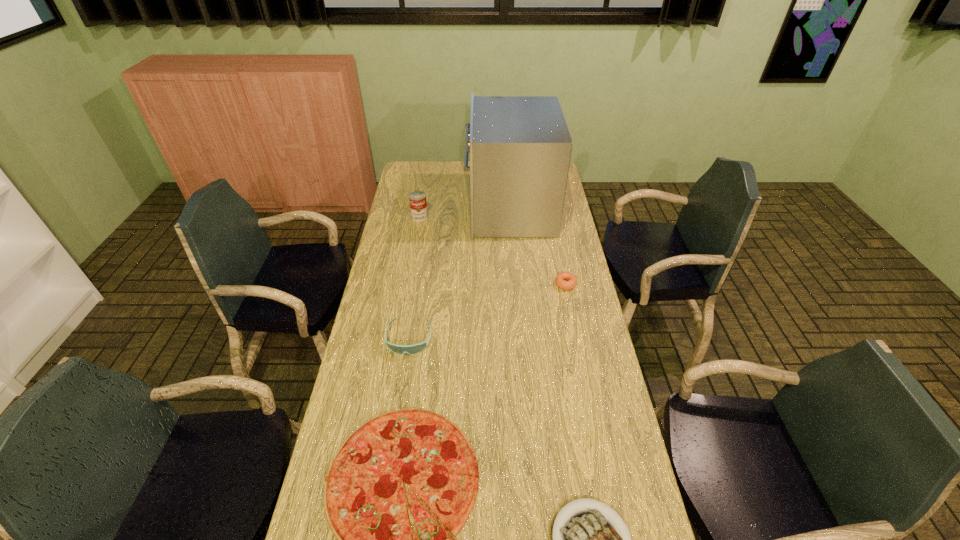
Find the location of `free space between the doughnut and the tallest object`. free space between the doughnut and the tallest object is located at coordinates (538, 247).

Locate an element on the screen. The width and height of the screenshot is (960, 540). blank region between the can and the third farthest object is located at coordinates (492, 250).

This screenshot has width=960, height=540. I want to click on vacant area between the fourth farthest object and the toaster oven, so click(459, 274).

This screenshot has height=540, width=960. Identify the location of free point between the fifth shortest object and the toaster oven. (465, 213).

Image resolution: width=960 pixels, height=540 pixels. What are the coordinates of `object that stands as the second closest to the shortest object` in the screenshot? It's located at (416, 348).

Select which object is the fourth closest to the tallest object. Please provide its 2D coordinates. Your answer should be formatted as a tuple, i.e. [(x, y)], where the tuple contains the x and y coordinates of a point satisfying the conditions above.

[(365, 504)]

In order to click on free space that satisfies the following two spatial constraints: 1. on the front panel of the tallest object; 2. on the front label of the can in this screenshot , I will do `click(510, 217)`.

Locate an element on the screen. The image size is (960, 540). vacant space that satisfies the following two spatial constraints: 1. on the front label of the can; 2. on the left side of the fourth nearest object is located at coordinates (408, 284).

Where is `free space in the image that satisfies the following two spatial constraints: 1. on the front panel of the tallest object; 2. on the front-facing side of the goggles`? The image size is (960, 540). free space in the image that satisfies the following two spatial constraints: 1. on the front panel of the tallest object; 2. on the front-facing side of the goggles is located at coordinates point(520,338).